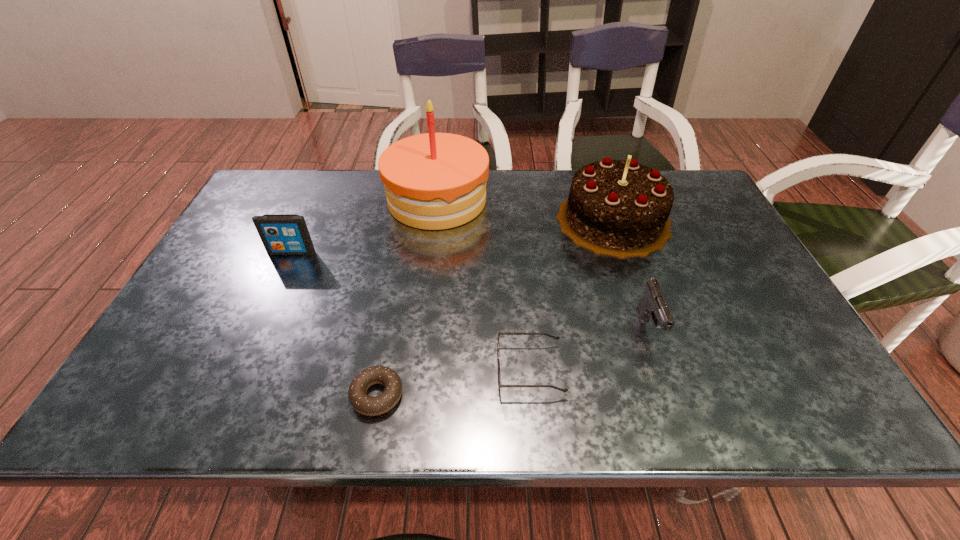
Find the location of a particular element. This screenshot has height=540, width=960. object that is positioned at the right edge is located at coordinates (619, 208).

The width and height of the screenshot is (960, 540). Find the location of `object present at the far right corner`. object present at the far right corner is located at coordinates (619, 208).

At what (x,y) coordinates should I click in order to perform the action: click on vacant area at the far edge. Please return your answer as a coordinate pair (x, y). This screenshot has width=960, height=540. Looking at the image, I should click on (362, 207).

Where is `free spot at the near edge of the desktop`? free spot at the near edge of the desktop is located at coordinates (406, 391).

Where is `vacant area at the left edge of the desktop`? vacant area at the left edge of the desktop is located at coordinates (198, 366).

At what (x,y) coordinates should I click in order to perform the action: click on vacant space at the right edge of the desktop. Please return your answer as a coordinate pair (x, y). Looking at the image, I should click on (724, 241).

Find the location of a particular element. The image size is (960, 540). free space at the near left corner of the desktop is located at coordinates (160, 394).

At what (x,y) coordinates should I click in order to perform the action: click on free spot at the far right corner of the desktop. Please return your answer as a coordinate pair (x, y). Looking at the image, I should click on (680, 178).

Locate an element on the screen. free space at the near right corner of the desktop is located at coordinates (829, 420).

Find the location of a particular element. vacant area that lies between the sunglasses and the doughnut is located at coordinates (453, 382).